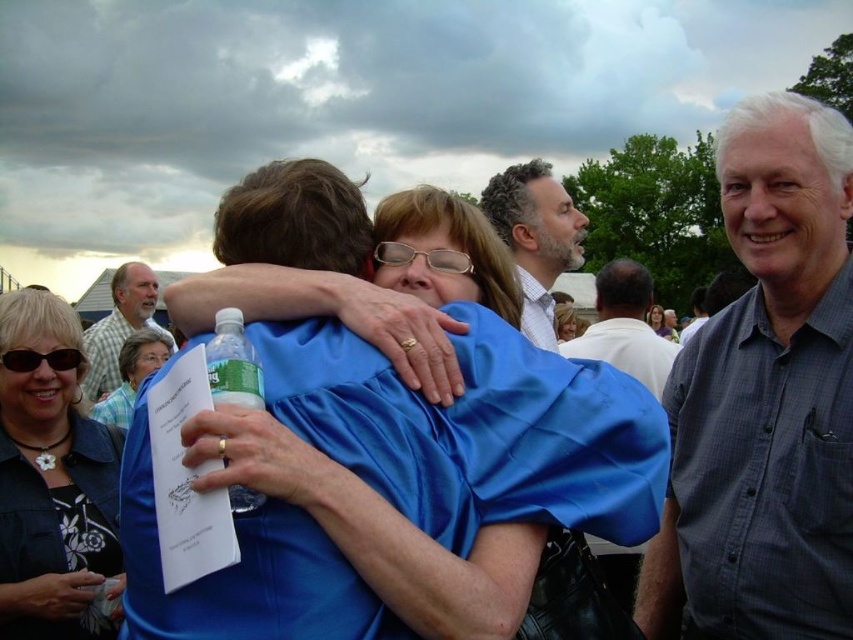
Question: Does white shirt at upper center have a larger size compared to matte black shirt at upper center?

Choices:
 (A) yes
 (B) no

Answer: (B)

Question: Which object is positioned farthest from the blue satin shirt at center?

Choices:
 (A) clear plastic bottle at center
 (B) grayish-blue shirt at upper center
 (C) blue fabric shirt at center
 (D) satin black shirt at center

Answer: (C)

Question: Estimate the real-world distances between objects in this image. Which object is farther from the plaid cotton shirt at left?

Choices:
 (A) blue satin shirt at center
 (B) satin black shirt at center
 (C) clear plastic bottle at center

Answer: (C)

Question: Among these objects, which one is farthest from the camera?

Choices:
 (A) matte black shirt at upper center
 (B) matte blue blouse at center
 (C) blue fabric shirt at center
 (D) satin black shirt at center

Answer: (B)

Question: Is blue satin shirt at center below white shirt at upper center?

Choices:
 (A) no
 (B) yes

Answer: (B)

Question: Does gray checkered shirt at right have a lesser width compared to matte black shirt at upper center?

Choices:
 (A) no
 (B) yes

Answer: (B)